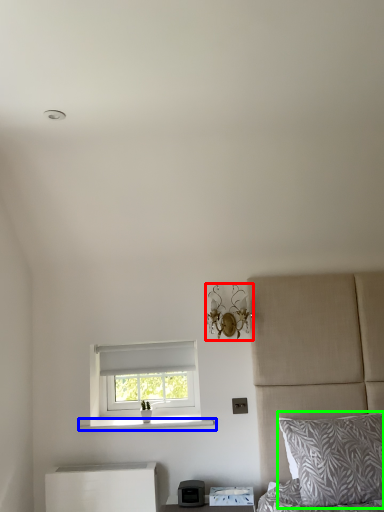
Question: Which is farther away from light fixture (highlighted by a red box)? window sill (highlighted by a blue box) or pillow (highlighted by a green box)?

Choices:
 (A) window sill
 (B) pillow

Answer: (B)